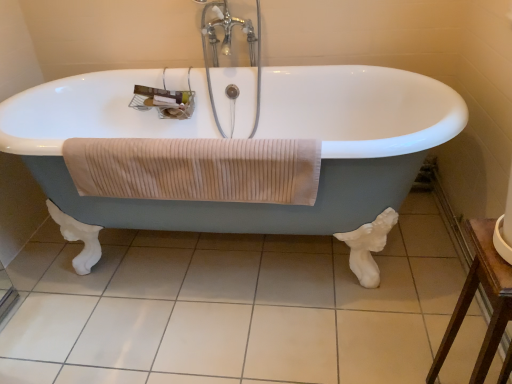
This screenshot has height=384, width=512. I want to click on empty space that is ontop of white tile at center, so click(x=230, y=289).